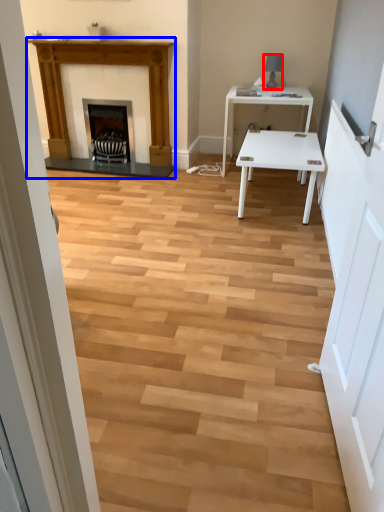
Question: Which point is further to the camera, lamp (highlighted by a red box) or fireplace (highlighted by a blue box)?

Choices:
 (A) lamp
 (B) fireplace

Answer: (A)